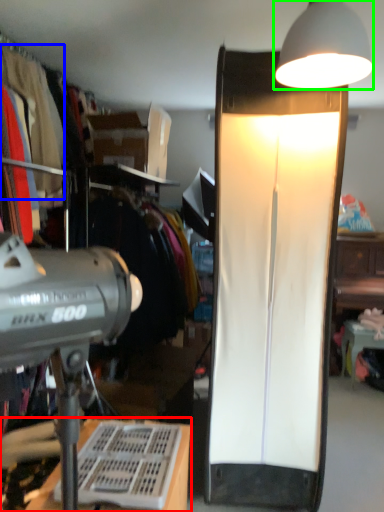
Question: Estimate the real-world distances between objects in this image. Which object is farther from desk (highlighted by a red box), clothing (highlighted by a blue box) or lamp (highlighted by a green box)?

Choices:
 (A) clothing
 (B) lamp

Answer: (B)